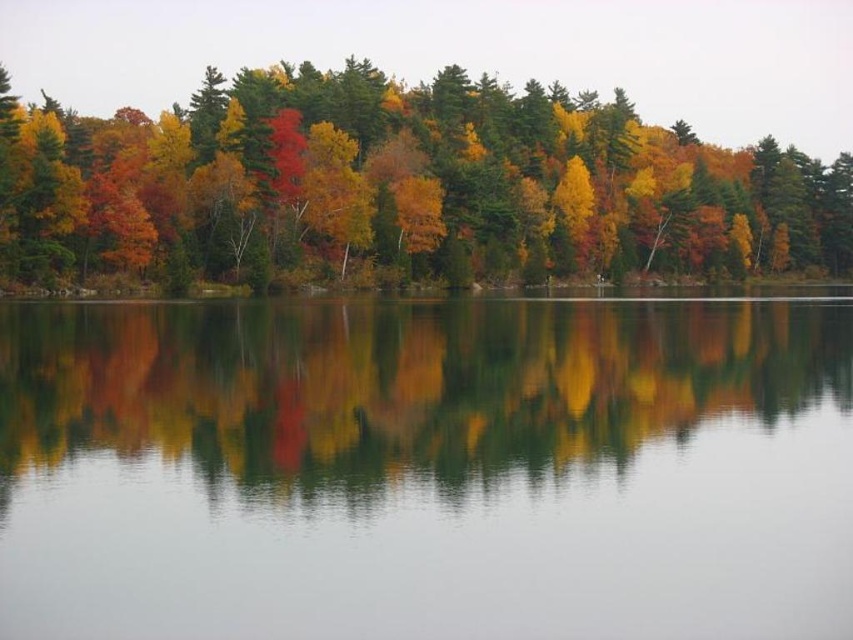
You are standing at the edge of the water and want to take a photo of the autumn leaves at upper center and the smooth water at center. Which object will appear closer to the camera in the photo?

The autumn leaves at upper center will appear closer to the camera in the photo because they have a greater height than the smooth water at center.